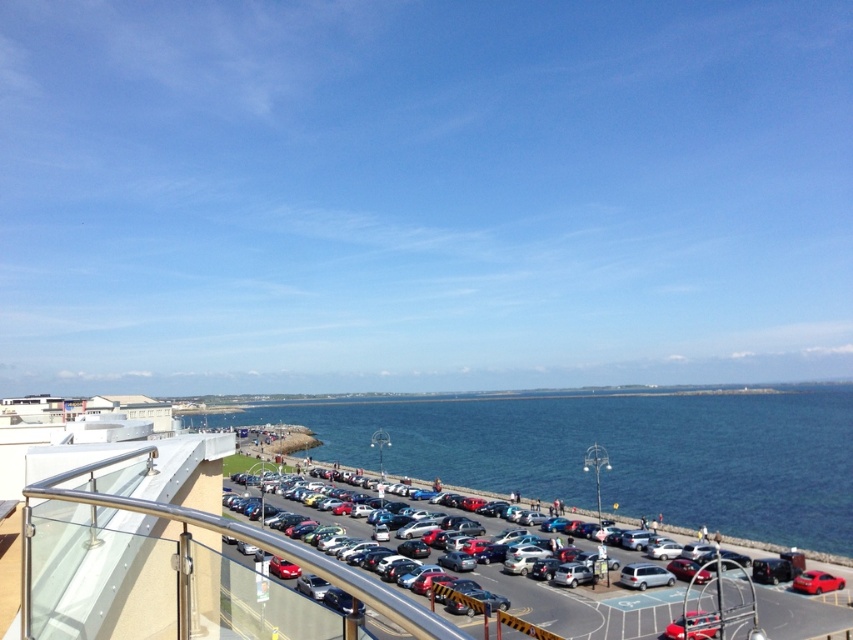
You are a delivery person who needs to park your 2.5 meters tall delivery van in the parking lot. The parking lot has two options available. One is the space near the metallic cars at center, and the other is the space near the shiny red car at lower right. Which parking space would be more suitable for your van based on the height?

The parking space near the metallic cars at center is more suitable for your 2.5 meters tall delivery van since the metallic cars at center are much taller than the shiny red car at lower right, indicating that the height clearance there is sufficient.

You are standing on the balcony and want to take a photo of the blue water at center. Which direction should you point your camera to capture it?

The blue water at center is located at point coordinates of (x=616, y=452), so you should point your camera towards the center of the image where the coordinates are to capture the blue water at center.